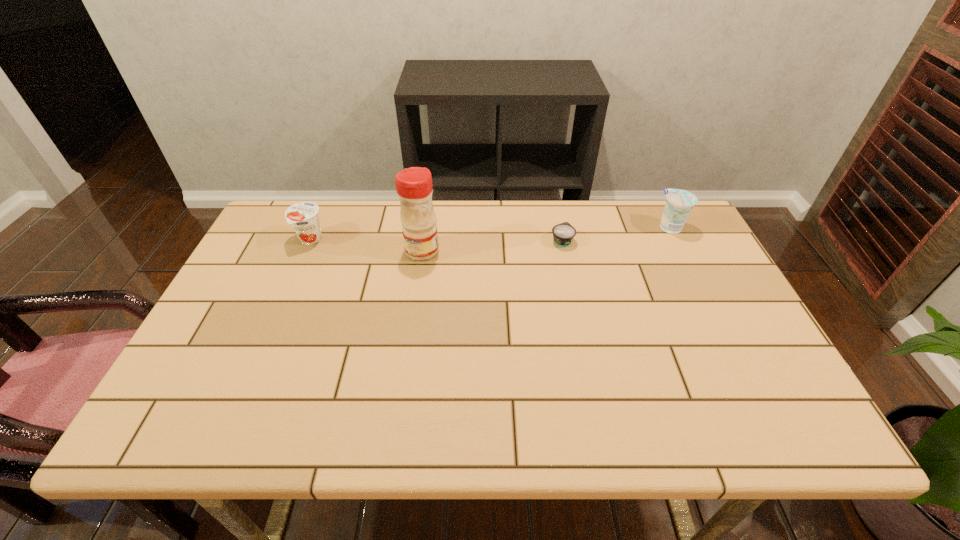
The image size is (960, 540). What are the coordinates of `vacant area that lies between the leftmost object and the condiment` in the screenshot? It's located at (366, 245).

The height and width of the screenshot is (540, 960). I want to click on blank region between the rightmost yogurt and the leftmost yogurt, so click(491, 234).

Identify the location of empty space between the rightmost object and the third object from left to right. This screenshot has height=540, width=960. (616, 234).

Identify the location of free space that is in between the second object from right to left and the condiment. The image size is (960, 540). pyautogui.click(x=492, y=246).

At what (x,y) coordinates should I click in order to perform the action: click on empty space between the third object from right to left and the rightmost object. Please return your answer as a coordinate pair (x, y). Looking at the image, I should click on (546, 239).

In order to click on unoccupied position between the tallest object and the leftmost yogurt in this screenshot , I will do `click(366, 245)`.

Where is `object that can be found as the closest to the rightmost yogurt`? object that can be found as the closest to the rightmost yogurt is located at coordinates (563, 234).

Point out which object is positioned as the second nearest to the rightmost yogurt. Please provide its 2D coordinates. Your answer should be formatted as a tuple, i.e. [(x, y)], where the tuple contains the x and y coordinates of a point satisfying the conditions above.

[(414, 188)]

Locate an element on the screen. Image resolution: width=960 pixels, height=540 pixels. yogurt object that ranks as the closest to the third object from left to right is located at coordinates (679, 203).

Select which yogurt is the second closest to the rightmost object. Please provide its 2D coordinates. Your answer should be formatted as a tuple, i.e. [(x, y)], where the tuple contains the x and y coordinates of a point satisfying the conditions above.

[(303, 216)]